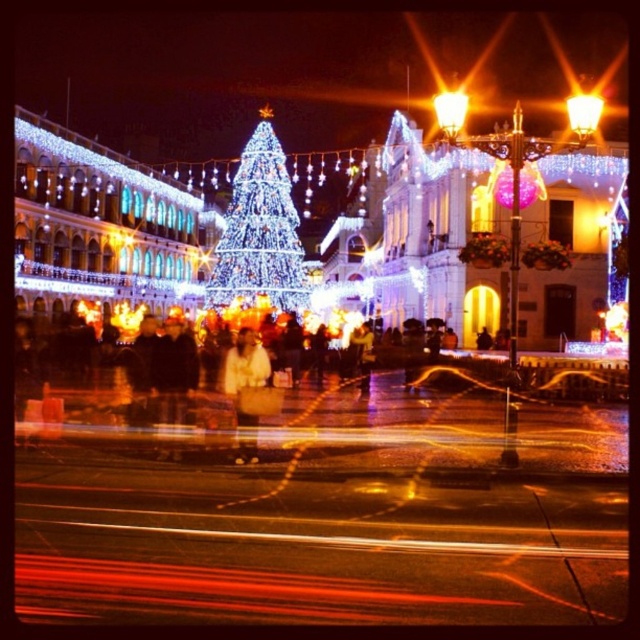
Can you confirm if metallic streetlight at center is wider than matte gold streetlight at upper right?

In fact, metallic streetlight at center might be narrower than matte gold streetlight at upper right.

Who is shorter, metallic streetlight at center or matte gold streetlight at upper right?

Standing shorter between the two is matte gold streetlight at upper right.

Image resolution: width=640 pixels, height=640 pixels. What are the coordinates of `metallic streetlight at center` in the screenshot? It's located at (451, 112).

Find the location of `metallic streetlight at center`. metallic streetlight at center is located at coordinates click(451, 112).

Does illuminated glass christmas tree at center appear over matte gold streetlight at upper right?

No, illuminated glass christmas tree at center is not above matte gold streetlight at upper right.

Which is in front, point (225, 301) or point (566, 102)?

Positioned in front is point (225, 301).

Does point (236, 221) lie behind point (582, 118)?

Yes, point (236, 221) is farther from viewer.

You are a GUI agent. You are given a task and a screenshot of the screen. Output one action in this format:
    pyautogui.click(x=<x>, y=<y>)
    Task: Click on the illuminated glass christmas tree at center
    This screenshot has width=640, height=640.
    Given the screenshot: What is the action you would take?
    pyautogui.click(x=259, y=237)

Does white matte coat at center lie in front of metallic streetlight at center?

Yes, white matte coat at center is closer to the viewer.

Is white matte coat at center bigger than metallic streetlight at center?

Actually, white matte coat at center might be smaller than metallic streetlight at center.

Locate an element on the screen. The height and width of the screenshot is (640, 640). white matte coat at center is located at coordinates (244, 364).